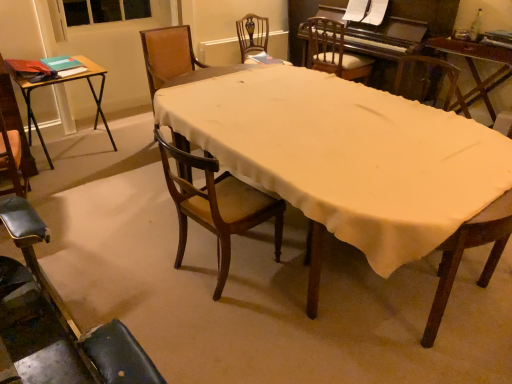
Image resolution: width=512 pixels, height=384 pixels. Describe the element at coordinates (167, 55) in the screenshot. I see `wooden chair at center, placed as the 3th chair when sorted from back to front` at that location.

What is the approximate height of wooden chair at center, which is the third chair from front to back?

35.88 inches.

This screenshot has height=384, width=512. Find the location of `wooden table at center`. wooden table at center is located at coordinates (354, 165).

What is the approximate height of leather seat at lower left, which is counted as the first chair, starting from the front?

The height of leather seat at lower left, which is counted as the first chair, starting from the front, is 19.12 inches.

Measure the distance between leather seat at lower left, the fifth chair positioned from the back, and camera.

The depth of leather seat at lower left, the fifth chair positioned from the back, is 1.69 meters.

What is the approximate width of wooden chair at upper center, positioned as the 2th chair in back-to-front order?

It is 21.60 inches.

Where is `wooden folding table at left, which is the second table from right to left`? The height and width of the screenshot is (384, 512). wooden folding table at left, which is the second table from right to left is located at coordinates (58, 83).

From a real-world perspective, is wooden table at center below polished dark wood piano at upper right?

Yes.

How far apart are wooden table at center and polished dark wood piano at upper right?

wooden table at center and polished dark wood piano at upper right are 1.38 meters apart from each other.

Is wooden table at center wider or thinner than polished dark wood piano at upper right?

wooden table at center is wider than polished dark wood piano at upper right.

Is wooden table at center next to polished dark wood piano at upper right and touching it?

They are not placed beside each other.

Is point (201, 81) closer to viewer compared to point (490, 87)?

Yes, it is in front of point (490, 87).

Which object is positioned more to the left, wooden table at center or wooden table at center, which appears as the 2th table when viewed from the left?

Positioned to the left is wooden table at center.

From a real-world perspective, who is located higher, wooden table at center or wooden table at center, which is the 1th table in right-to-left order?

In real-world perspective, wooden table at center, which is the 1th table in right-to-left order, is above.

From the image's perspective, relative to polished dark wood piano at upper right, is leather seat at lower left, which is counted as the first chair, starting from the front, above or below?

Clearly, from the image's perspective, leather seat at lower left, which is counted as the first chair, starting from the front, is below polished dark wood piano at upper right.

Is leather seat at lower left, the fifth chair positioned from the back, wider or thinner than polished dark wood piano at upper right?

leather seat at lower left, the fifth chair positioned from the back, is thinner than polished dark wood piano at upper right.

Can you confirm if leather seat at lower left, which is counted as the first chair, starting from the front, is taller than polished dark wood piano at upper right?

In fact, leather seat at lower left, which is counted as the first chair, starting from the front, may be shorter than polished dark wood piano at upper right.

Would you say leather seat at lower left, which is counted as the first chair, starting from the front, contains polished dark wood piano at upper right?

Definitely not — polished dark wood piano at upper right is not inside leather seat at lower left, which is counted as the first chair, starting from the front.

Is point (184, 67) closer to camera compared to point (212, 191)?

No, it is behind (212, 191).

Is the surface of wooden chair at center, which is the third chair from front to back, in direct contact with brown wood chair at center, which appears as the second chair when viewed from the front?

wooden chair at center, which is the third chair from front to back, is not next to brown wood chair at center, which appears as the second chair when viewed from the front, and they're not touching.

Is wooden chair at center, placed as the 3th chair when sorted from back to front, inside the boundaries of brown wood chair at center, which appears as the second chair when viewed from the front, or outside?

The correct answer is: outside.

Does wooden chair at center, placed as the 3th chair when sorted from back to front, appear on the left side of brown wood chair at center, which is counted as the 4th chair, starting from the back?

Yes, wooden chair at center, placed as the 3th chair when sorted from back to front, is to the left of brown wood chair at center, which is counted as the 4th chair, starting from the back.

Where is `chair that is the 3rd object located in front of the wooden chair with ornate backrest at center, the first chair viewed from the back`? The width and height of the screenshot is (512, 384). chair that is the 3rd object located in front of the wooden chair with ornate backrest at center, the first chair viewed from the back is located at coordinates point(217,206).

How different are the orientations of brown wood chair at center, which is counted as the 4th chair, starting from the back, and wooden chair with ornate backrest at center, the fifth chair in the front-to-back sequence, in degrees?

They differ by 98.9 degrees in their facing directions.

Is brown wood chair at center, which is counted as the 4th chair, starting from the back, far from wooden chair with ornate backrest at center, the fifth chair in the front-to-back sequence?

Yes.

Does point (222, 176) come farther from viewer compared to point (240, 21)?

No, it is in front of (240, 21).

Which point is more forward, [262,40] or [381,61]?

The point [381,61] is in front.

Could you tell me if wooden chair with ornate backrest at center, the fifth chair in the front-to-back sequence, is facing polished dark wood piano at upper right?

No.

Which of these two, wooden chair with ornate backrest at center, the fifth chair in the front-to-back sequence, or polished dark wood piano at upper right, is smaller?

wooden chair with ornate backrest at center, the fifth chair in the front-to-back sequence, is smaller.

Is wooden chair with ornate backrest at center, the fifth chair in the front-to-back sequence, inside or outside of polished dark wood piano at upper right?

wooden chair with ornate backrest at center, the fifth chair in the front-to-back sequence, is not inside polished dark wood piano at upper right, it's outside.

From a real-world perspective, which object stands above the other?

From a 3D spatial view, wooden chair with ornate backrest at center, the fifth chair in the front-to-back sequence, is above.

In order to click on chair that is the 1st one when counting downward from the wooden chair with ornate backrest at center, the fifth chair in the front-to-back sequence (from the image's perspective) in this screenshot , I will do `click(335, 51)`.

Does wooden chair with ornate backrest at center, the fifth chair in the front-to-back sequence, lie behind wooden chair at upper center, which is counted as the fourth chair, starting from the front?

Yes, it is behind wooden chair at upper center, which is counted as the fourth chair, starting from the front.

Image resolution: width=512 pixels, height=384 pixels. Find the location of `piano on the right of wooden table at center`. piano on the right of wooden table at center is located at coordinates (413, 20).

Image resolution: width=512 pixels, height=384 pixels. What are the coordinates of `desk that is in front of the wooden table at center, which appears as the 2th table when viewed from the left` in the screenshot? It's located at (354, 165).

When comparing their distances from wooden chair with ornate backrest at center, the first chair viewed from the back, does wooden folding table at left, which is the second table from right to left, or wooden chair at upper center, positioned as the 2th chair in back-to-front order, seem closer?

Among the two, wooden chair at upper center, positioned as the 2th chair in back-to-front order, is located nearer to wooden chair with ornate backrest at center, the first chair viewed from the back.

When comparing their distances from wooden chair at upper center, which is counted as the fourth chair, starting from the front, does wooden table at center or wooden folding table at left, the 1th table viewed from the left, seem further?

wooden folding table at left, the 1th table viewed from the left, lies further to wooden chair at upper center, which is counted as the fourth chair, starting from the front, than the other object.

Estimate the real-world distances between objects in this image. Which object is closer to green glass bottle at upper right, wooden chair with ornate backrest at center, the fifth chair in the front-to-back sequence, or wooden table at center, which appears as the 2th table when viewed from the left?

The object closer to green glass bottle at upper right is wooden table at center, which appears as the 2th table when viewed from the left.

Looking at the image, which one is located further to wooden table at center, wooden folding table at left, the 1th table viewed from the left, or leather seat at lower left, which is counted as the first chair, starting from the front?

Based on the image, wooden folding table at left, the 1th table viewed from the left, appears to be further to wooden table at center.

From the image, which object appears to be nearer to wooden table at center, which is the 1th table in right-to-left order, polished dark wood piano at upper right or wooden chair with ornate backrest at center, the fifth chair in the front-to-back sequence?

The object closer to wooden table at center, which is the 1th table in right-to-left order, is polished dark wood piano at upper right.

Considering their positions, is leather seat at lower left, which is counted as the first chair, starting from the front, positioned further to polished dark wood piano at upper right than wooden table at center?

leather seat at lower left, which is counted as the first chair, starting from the front, is further to polished dark wood piano at upper right.

Based on their spatial positions, is wooden chair with ornate backrest at center, the first chair viewed from the back, or brown wood chair at center, which appears as the second chair when viewed from the front, further from wooden chair at upper center, positioned as the 2th chair in back-to-front order?

brown wood chair at center, which appears as the second chair when viewed from the front, is further to wooden chair at upper center, positioned as the 2th chair in back-to-front order.

Which object lies further to the anchor point polished dark wood piano at upper right, wooden chair at center, placed as the 3th chair when sorted from back to front, or green glass bottle at upper right?

Among the two, wooden chair at center, placed as the 3th chair when sorted from back to front, is located further to polished dark wood piano at upper right.

Where is `table between brown wood chair at center, which appears as the second chair when viewed from the front, and green glass bottle at upper right from left to right`? table between brown wood chair at center, which appears as the second chair when viewed from the front, and green glass bottle at upper right from left to right is located at coordinates (475, 67).

Where is `piano between leather seat at lower left, which is counted as the first chair, starting from the front, and green glass bottle at upper right from front to back`? The height and width of the screenshot is (384, 512). piano between leather seat at lower left, which is counted as the first chair, starting from the front, and green glass bottle at upper right from front to back is located at coordinates pos(413,20).

Where is `piano between brown wood chair at center, which is counted as the 4th chair, starting from the back, and wooden chair at upper center, positioned as the 2th chair in back-to-front order, in the front-back direction`? piano between brown wood chair at center, which is counted as the 4th chair, starting from the back, and wooden chair at upper center, positioned as the 2th chair in back-to-front order, in the front-back direction is located at coordinates click(413, 20).

I want to click on piano situated between wooden chair at upper center, positioned as the 2th chair in back-to-front order, and wooden table at center, which is the 1th table in right-to-left order, from left to right, so (x=413, y=20).